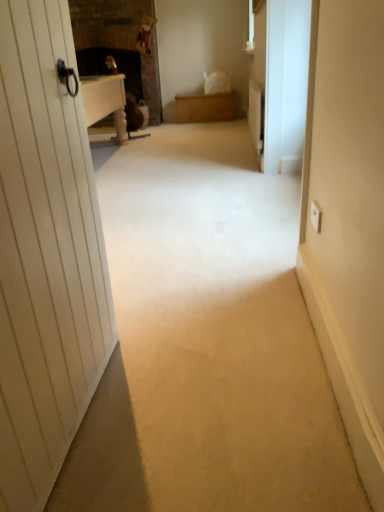
Question: Is white matte screen door at right placed right next to wooden chest at center?

Choices:
 (A) no
 (B) yes

Answer: (A)

Question: From a real-world perspective, is white matte screen door at right beneath wooden chest at center?

Choices:
 (A) yes
 (B) no

Answer: (B)

Question: From the image's perspective, is white matte screen door at right on top of wooden chest at center?

Choices:
 (A) no
 (B) yes

Answer: (A)

Question: From a real-world perspective, is white matte screen door at right physically above wooden chest at center?

Choices:
 (A) yes
 (B) no

Answer: (A)

Question: Can you confirm if white matte screen door at right is smaller than wooden chest at center?

Choices:
 (A) yes
 (B) no

Answer: (A)

Question: Is white matte screen door at right oriented away from wooden chest at center?

Choices:
 (A) no
 (B) yes

Answer: (A)

Question: Is wooden chest at center next to white matte screen door at right?

Choices:
 (A) yes
 (B) no

Answer: (B)

Question: Would you consider wooden chest at center to be distant from white matte screen door at right?

Choices:
 (A) no
 (B) yes

Answer: (B)

Question: Considering the relative sizes of wooden chest at center and white matte screen door at right in the image provided, is wooden chest at center taller than white matte screen door at right?

Choices:
 (A) no
 (B) yes

Answer: (A)

Question: Is wooden chest at center wider than white matte screen door at right?

Choices:
 (A) no
 (B) yes

Answer: (B)

Question: Is wooden chest at center to the left of white matte screen door at right from the viewer's perspective?

Choices:
 (A) yes
 (B) no

Answer: (A)

Question: Is wooden chest at center aimed at white matte screen door at right?

Choices:
 (A) no
 (B) yes

Answer: (B)

Question: Can you confirm if polished brass door handle at upper left is positioned to the left of wooden chest at center?

Choices:
 (A) no
 (B) yes

Answer: (B)